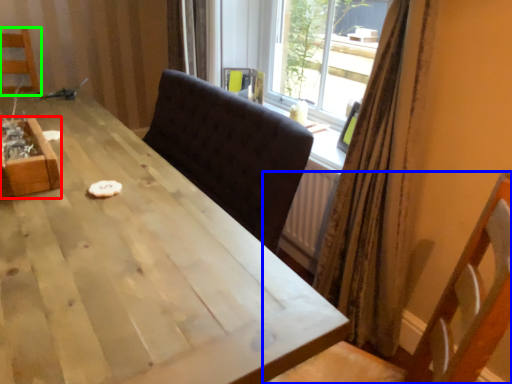
Question: Considering the real-world distances, which object is farthest from crate (highlighted by a red box)? chair (highlighted by a blue box) or chair (highlighted by a green box)?

Choices:
 (A) chair
 (B) chair

Answer: (B)